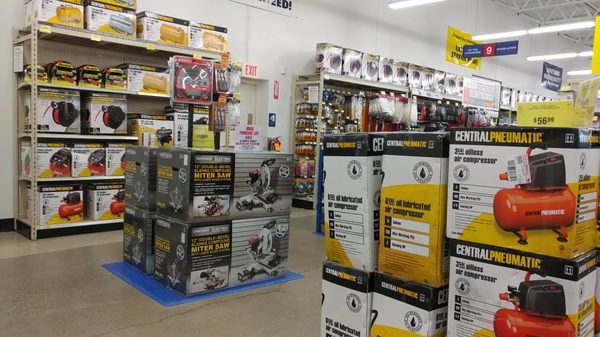
Where is `blue mat`? blue mat is located at coordinates (151, 288).